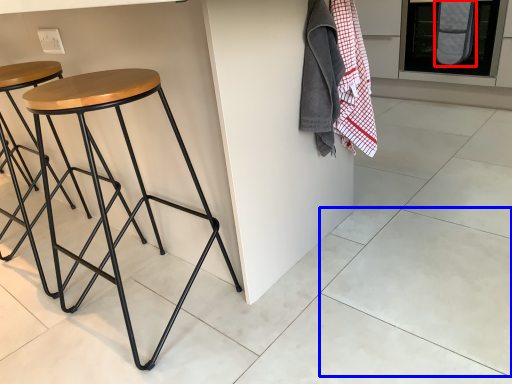
Question: Which object is closer to the camera taking this photo, blanket (highlighted by a red box) or tile (highlighted by a blue box)?

Choices:
 (A) blanket
 (B) tile

Answer: (B)